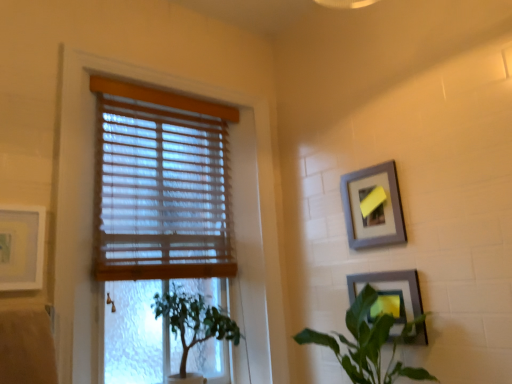
Question: Considering the positions of wooden blinds at upper left and green leafy plant at lower left, which ranks as the 2th houseplant in right-to-left order, in the image, is wooden blinds at upper left bigger or smaller than green leafy plant at lower left, which ranks as the 2th houseplant in right-to-left order,?

Choices:
 (A) small
 (B) big

Answer: (B)

Question: Is wooden blinds at upper left to the left or to the right of green leafy plant at lower left, the first houseplant in the left-to-right sequence, in the image?

Choices:
 (A) left
 (B) right

Answer: (A)

Question: Considering the real-world distances, which object is farthest from the wooden blinds at left?

Choices:
 (A) matte white picture frame at left, placed as the 3th picture frame when sorted from right to left
 (B) gray matte picture frame at upper right, the second picture frame positioned from the right
 (C) wooden blinds at upper left
 (D) green leafy plant at lower right, which is the 1th houseplant from right to left
 (E) green leafy plant at lower left, the first houseplant in the left-to-right sequence

Answer: (B)

Question: Which of these objects is positioned closest to the gray matte picture frame at upper right, the second picture frame when ordered from left to right?

Choices:
 (A) green leafy plant at lower right, which is the 1th houseplant from right to left
 (B) green leafy plant at lower left, which ranks as the 2th houseplant in right-to-left order
 (C) matte white picture frame at left, placed as the 3th picture frame when sorted from right to left
 (D) matte gray picture frame at lower right, which is the first picture frame from right to left
 (E) wooden blinds at left

Answer: (D)